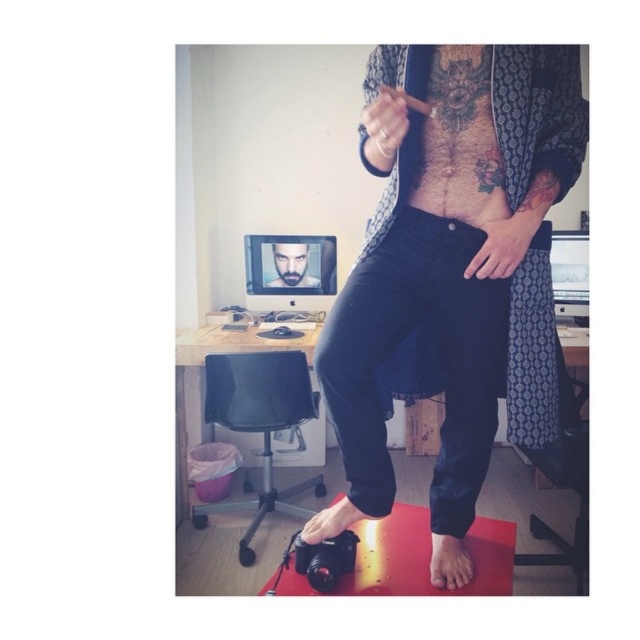
Question: Which object is the farthest from the smooth skin foot at lower center?

Choices:
 (A) dark skin tattooed torso at center
 (B) matte black jeans at center
 (C) smooth skin face at center
 (D) matte black foot at lower center

Answer: (C)

Question: Can you confirm if smooth skin foot at lower center is positioned below smooth skin face at center?

Choices:
 (A) yes
 (B) no

Answer: (A)

Question: Is matte black jeans at center smaller than matte black foot at lower center?

Choices:
 (A) no
 (B) yes

Answer: (A)

Question: Does dark skin tattooed torso at center appear over matte black foot at lower center?

Choices:
 (A) no
 (B) yes

Answer: (B)

Question: Considering the real-world distances, which object is closest to the matte black jeans at center?

Choices:
 (A) matte black foot at lower center
 (B) smooth skin face at center
 (C) smooth skin foot at lower center
 (D) dark skin tattooed torso at center

Answer: (D)

Question: Which of the following is the closest to the observer?

Choices:
 (A) (323, 531)
 (B) (467, 193)
 (C) (312, 282)
 (D) (396, 332)

Answer: (B)